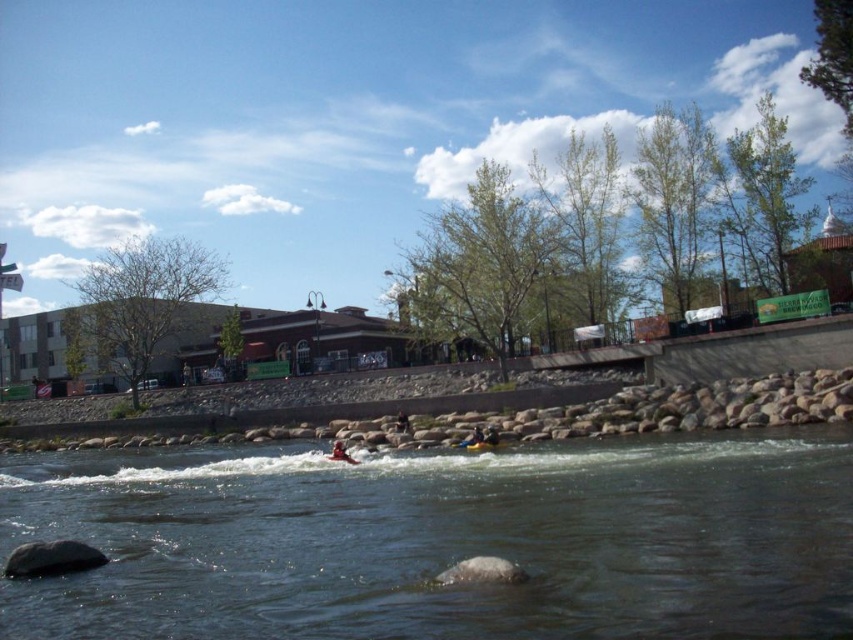
Question: Does clear water at center have a larger size compared to yellow life jacket at center?

Choices:
 (A) yes
 (B) no

Answer: (A)

Question: In this image, where is clear water at center located relative to yellow rubber boat at center?

Choices:
 (A) left
 (B) right

Answer: (A)

Question: Which object is positioned farthest from the yellow life jacket at center?

Choices:
 (A) orange life jacket at center
 (B) dark blue fabric kayak at center
 (C) clear water at center
 (D) yellow rubber boat at center

Answer: (C)

Question: Does clear water at center appear on the right side of dark blue fabric kayak at center?

Choices:
 (A) yes
 (B) no

Answer: (B)

Question: Which object is closer to the camera taking this photo?

Choices:
 (A) clear water at center
 (B) yellow rubber boat at center
 (C) yellow life jacket at center

Answer: (A)

Question: Among these objects, which one is nearest to the camera?

Choices:
 (A) clear water at center
 (B) yellow rubber boat at center
 (C) dark blue fabric kayak at center
 (D) orange life jacket at center

Answer: (A)